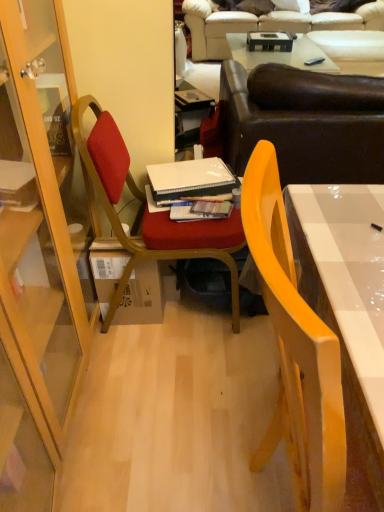
This screenshot has width=384, height=512. I want to click on free spot above white matte notebook at center, the 1th book from the back (from a real-world perspective), so click(185, 175).